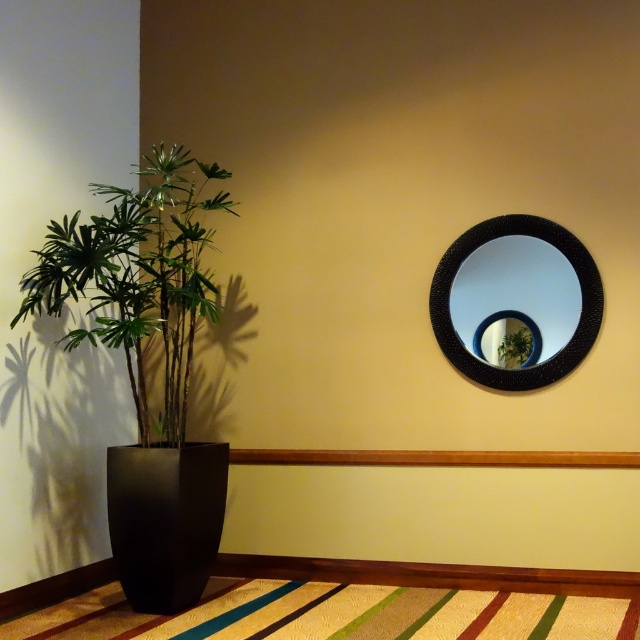
In the scene shown: You are standing in the room and want to place a 2.5 meter long sofa between the green matte plant at left and the black textured mirror at upper right. Is there enough space for the sofa?

The distance between the green matte plant at left and the black textured mirror at upper right is 2.12 meters. Since the sofa is 2.5 meters long, it would not fit in the available space.

You are arranging flowers in a living room and need to place the black matte vase at left and the green leafy plant at upper right. Which object is taller?

The black matte vase at left is taller than the green leafy plant at upper right according to the description.